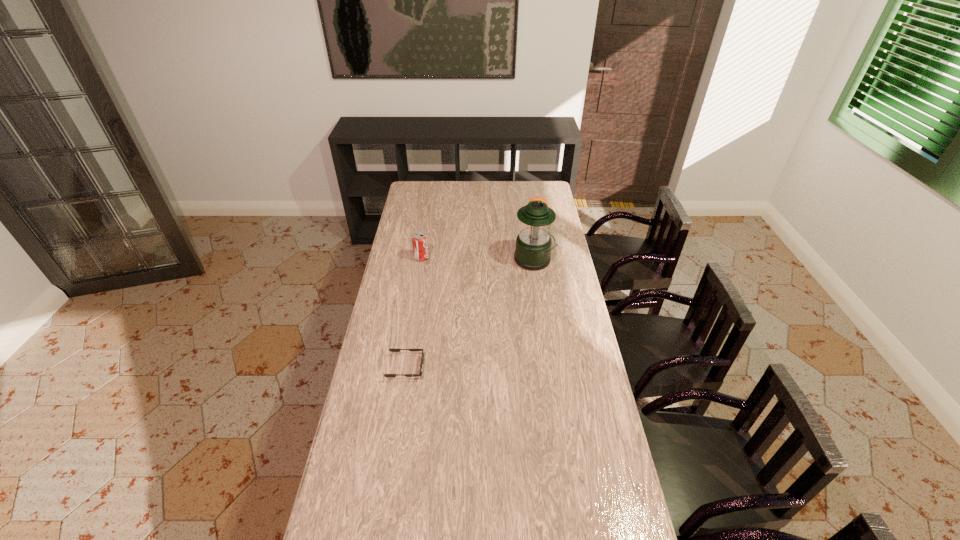
This screenshot has width=960, height=540. I want to click on soda can that is at the left edge, so click(419, 239).

Identify the location of sunglasses that is at the left edge. The width and height of the screenshot is (960, 540). (391, 350).

Locate an element on the screen. The image size is (960, 540). lantern located in the right edge section of the desktop is located at coordinates (533, 246).

Locate an element on the screen. The image size is (960, 540). orange present at the right edge is located at coordinates (539, 198).

This screenshot has height=540, width=960. In order to click on vacant area at the left edge of the desktop in this screenshot , I will do `click(404, 240)`.

The width and height of the screenshot is (960, 540). In the image, there is a desktop. Identify the location of vacant space at the right edge. (603, 478).

Find the location of a particular element. vacant space at the far left corner of the desktop is located at coordinates (418, 181).

At what (x,y) coordinates should I click in order to perform the action: click on vacant space at the far right corner of the desktop. Please return your answer as a coordinate pair (x, y). This screenshot has height=540, width=960. Looking at the image, I should click on (534, 180).

I want to click on free space between the nearest object and the farthest object, so pyautogui.click(x=471, y=292).

You are a GUI agent. You are given a task and a screenshot of the screen. Output one action in this format:
    pyautogui.click(x=<x>, y=<y>)
    Task: Click on the vacant space that is in between the nearest object and the farthest object
    The width and height of the screenshot is (960, 540).
    Given the screenshot: What is the action you would take?
    471,292